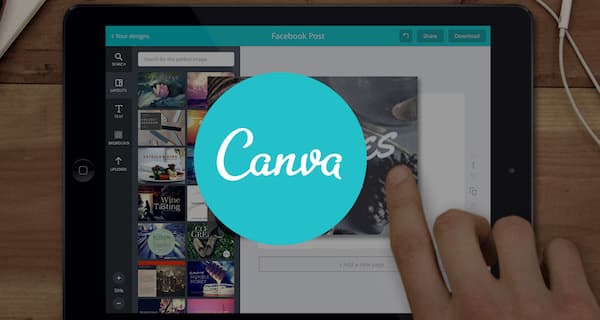
Where is `table countertop`? This screenshot has height=320, width=600. table countertop is located at coordinates (27, 194).